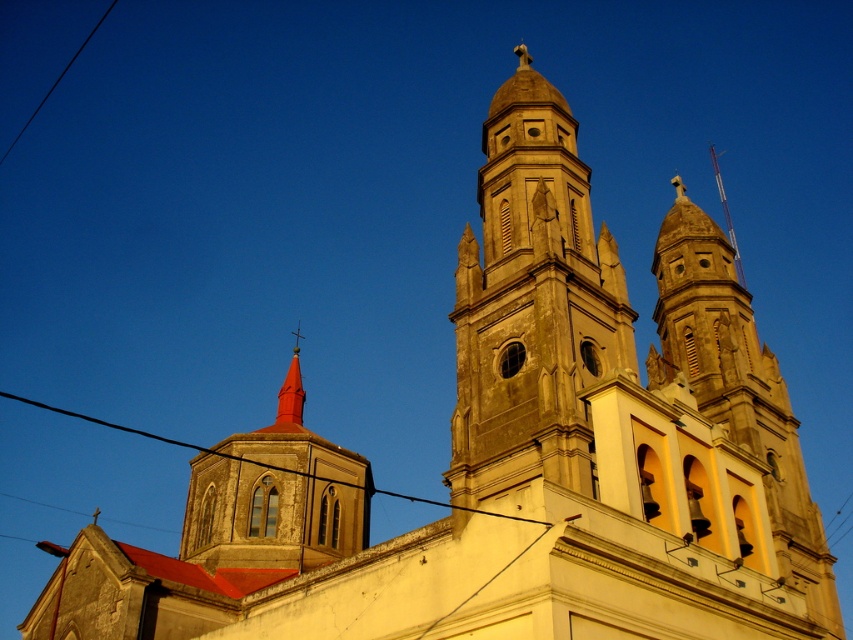
Question: Considering the relative positions of light beige stone tower at center and smooth red spire at center in the image provided, where is light beige stone tower at center located with respect to smooth red spire at center?

Choices:
 (A) above
 (B) below

Answer: (A)

Question: Which object appears farthest from the camera in this image?

Choices:
 (A) smooth red spire at center
 (B) smooth stone steeple at upper left

Answer: (A)

Question: Can you confirm if smooth stone steeple at upper left is thinner than black wire at upper center?

Choices:
 (A) yes
 (B) no

Answer: (A)

Question: Does black wire at upper center come in front of smooth red spire at center?

Choices:
 (A) yes
 (B) no

Answer: (A)

Question: Which point is closer to the camera taking this photo?

Choices:
 (A) (125, 428)
 (B) (276, 452)
 (C) (299, 388)

Answer: (B)

Question: Estimate the real-world distances between objects in this image. Which object is farther from the light beige stone tower at center?

Choices:
 (A) smooth red spire at center
 (B) black wire at upper center
 (C) smooth stone steeple at upper left

Answer: (A)